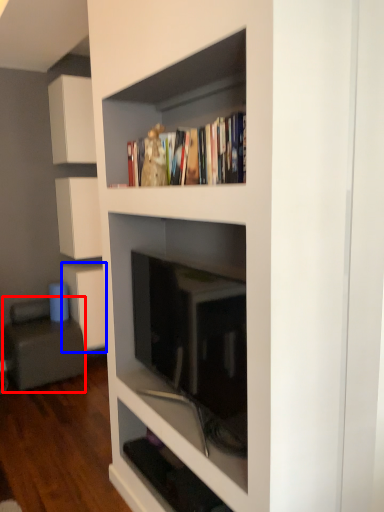
Question: Which object appears farthest to the camera in this image, armchair (highlighted by a red box) or cabinetry (highlighted by a blue box)?

Choices:
 (A) armchair
 (B) cabinetry

Answer: (B)